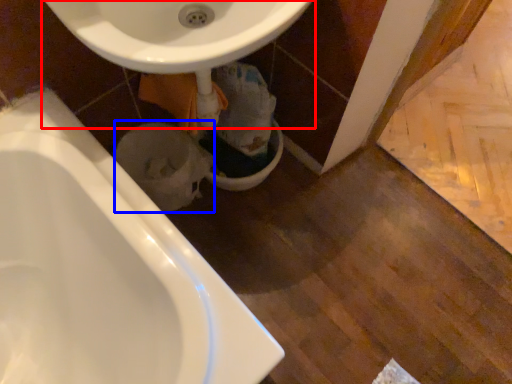
Question: Which object is further to the camera taking this photo, sink (highlighted by a red box) or toilet bowl (highlighted by a blue box)?

Choices:
 (A) sink
 (B) toilet bowl

Answer: (B)